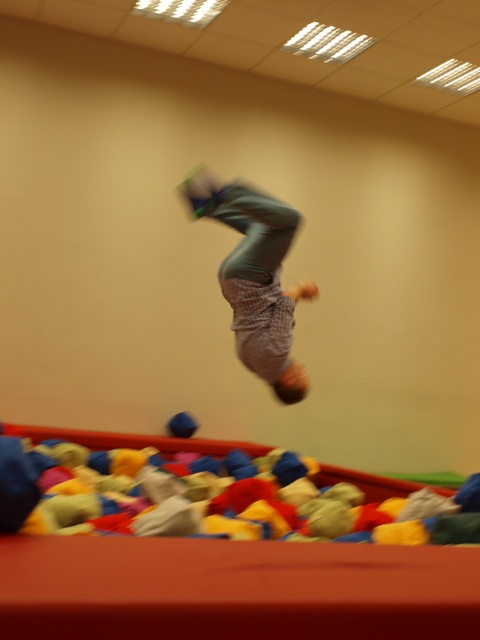
Question: Does soft fabric ball at center appear on the right side of plaid fabric pants at center?

Choices:
 (A) no
 (B) yes

Answer: (A)

Question: Is soft fabric ball at center in front of plaid fabric pants at center?

Choices:
 (A) no
 (B) yes

Answer: (B)

Question: Is soft fabric ball at center bigger than plaid fabric pants at center?

Choices:
 (A) yes
 (B) no

Answer: (A)

Question: Which point is closer to the camera?

Choices:
 (A) (182, 532)
 (B) (268, 230)

Answer: (A)

Question: Which of the following is the farthest from the observer?

Choices:
 (A) soft fabric ball at center
 (B) plaid fabric pants at center

Answer: (B)

Question: Which object appears closest to the camera in this image?

Choices:
 (A) plaid fabric pants at center
 (B) soft fabric ball at center

Answer: (B)